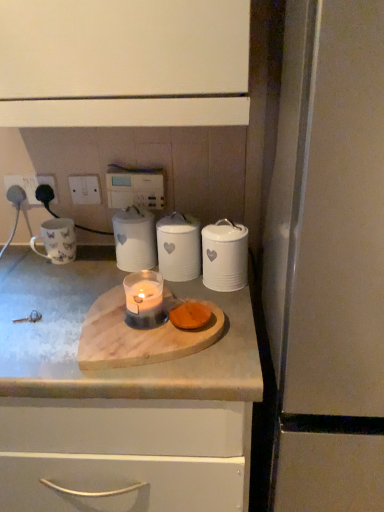
Question: Considering the relative positions of white glossy electric outlet at upper left, which is the second electric outlet from right to left, and white plastic electric outlet at upper left, which ranks as the 1th electric outlet in right-to-left order, in the image provided, is white glossy electric outlet at upper left, which is the second electric outlet from right to left, behind white plastic electric outlet at upper left, which ranks as the 1th electric outlet in right-to-left order,?

Choices:
 (A) yes
 (B) no

Answer: (B)

Question: Is white glossy electric outlet at upper left, arranged as the 2th electric outlet when viewed from the left, not inside white plastic electric outlet at upper left, which ranks as the 1th electric outlet in right-to-left order?

Choices:
 (A) yes
 (B) no

Answer: (A)

Question: Is the depth of white glossy electric outlet at upper left, which is the second electric outlet from right to left, less than that of white plastic electric outlet at upper left, the 3th electric outlet in the left-to-right sequence?

Choices:
 (A) yes
 (B) no

Answer: (A)

Question: Can you confirm if white glossy electric outlet at upper left, which is the second electric outlet from right to left, is bigger than white plastic electric outlet at upper left, which ranks as the 1th electric outlet in right-to-left order?

Choices:
 (A) yes
 (B) no

Answer: (B)

Question: Does white glossy electric outlet at upper left, arranged as the 2th electric outlet when viewed from the left, have a lesser height compared to white plastic electric outlet at upper left, which ranks as the 1th electric outlet in right-to-left order?

Choices:
 (A) yes
 (B) no

Answer: (A)

Question: From the image's perspective, is matte white mug at left located above or below white ceramic canister at center, marked as the 2th kitchen appliance in a left-to-right arrangement?

Choices:
 (A) below
 (B) above

Answer: (B)

Question: Considering the relative positions of matte white mug at left and white ceramic canister at center, marked as the 2th kitchen appliance in a left-to-right arrangement, in the image provided, is matte white mug at left to the left or to the right of white ceramic canister at center, marked as the 2th kitchen appliance in a left-to-right arrangement,?

Choices:
 (A) right
 (B) left

Answer: (B)

Question: Is matte white mug at left taller or shorter than white ceramic canister at center, marked as the 2th kitchen appliance in a left-to-right arrangement?

Choices:
 (A) tall
 (B) short

Answer: (B)

Question: Based on their sizes in the image, would you say matte white mug at left is bigger or smaller than white ceramic canister at center, marked as the 2th kitchen appliance in a left-to-right arrangement?

Choices:
 (A) small
 (B) big

Answer: (A)

Question: Considering the positions of white plastic electric outlet at upper left, which ranks as the 1th electric outlet in right-to-left order, and white plastic socket at upper left, arranged as the third electric outlet when viewed from the right, in the image, is white plastic electric outlet at upper left, which ranks as the 1th electric outlet in right-to-left order, wider or thinner than white plastic socket at upper left, arranged as the third electric outlet when viewed from the right,?

Choices:
 (A) wide
 (B) thin

Answer: (B)

Question: Would you say white plastic electric outlet at upper left, which ranks as the 1th electric outlet in right-to-left order, is to the left or to the right of white plastic socket at upper left, which is the 1th electric outlet in left-to-right order, in the picture?

Choices:
 (A) left
 (B) right

Answer: (B)

Question: From a real-world perspective, is white plastic electric outlet at upper left, which ranks as the 1th electric outlet in right-to-left order, physically located above or below white plastic socket at upper left, which is the 1th electric outlet in left-to-right order?

Choices:
 (A) below
 (B) above

Answer: (A)

Question: Considering the positions of white plastic electric outlet at upper left, which ranks as the 1th electric outlet in right-to-left order, and white plastic socket at upper left, arranged as the third electric outlet when viewed from the right, in the image, is white plastic electric outlet at upper left, which ranks as the 1th electric outlet in right-to-left order, bigger or smaller than white plastic socket at upper left, arranged as the third electric outlet when viewed from the right,?

Choices:
 (A) big
 (B) small

Answer: (B)

Question: From the image's perspective, is matte white mug at left above or below wooden cutting board at center?

Choices:
 (A) below
 (B) above

Answer: (B)

Question: Is matte white mug at left spatially inside wooden cutting board at center, or outside of it?

Choices:
 (A) inside
 (B) outside

Answer: (B)